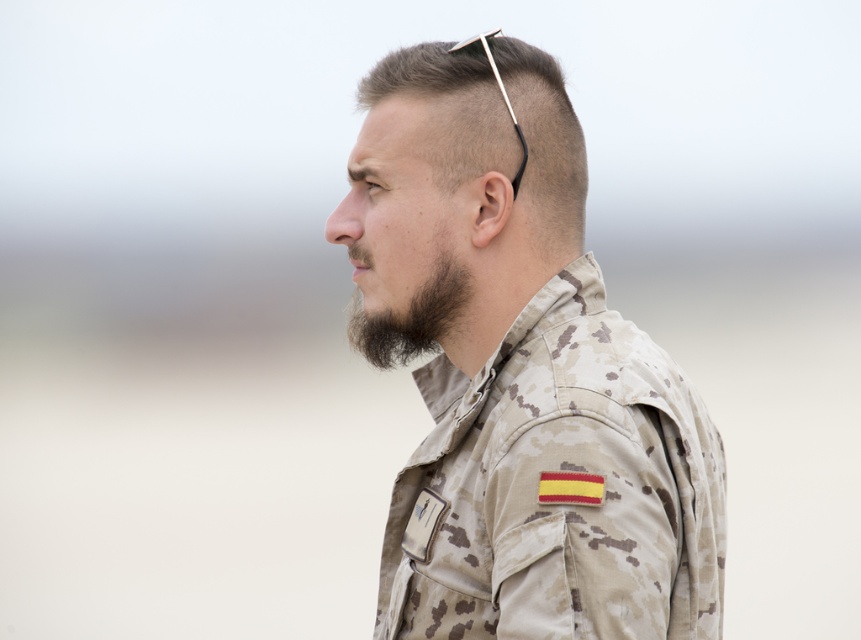
You are an observer looking at the image of the man in the military uniform. There are two points marked in the image. Which point is closer to you, point (x=519, y=237) or point (x=460, y=260)?

Point (x=519, y=237) is closer to the viewer than point (x=460, y=260).

Looking at this image, you are a tailor trying to determine which object is bigger between the camouflage fabric head at center and the dark brown fuzzy beard at lower left. Which one is larger?

The camouflage fabric head at center has a larger size compared to the dark brown fuzzy beard at lower left, so the camouflage fabric head at center is bigger.